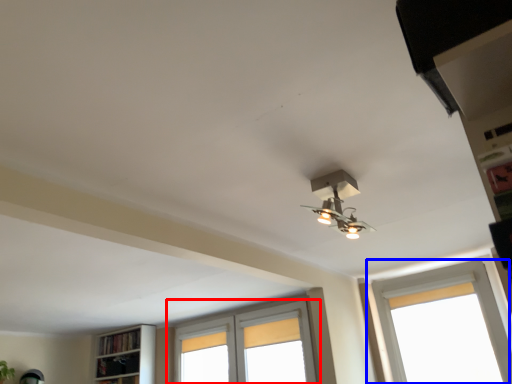
Question: Which point is further to the camera, window (highlighted by a red box) or window (highlighted by a blue box)?

Choices:
 (A) window
 (B) window

Answer: (A)